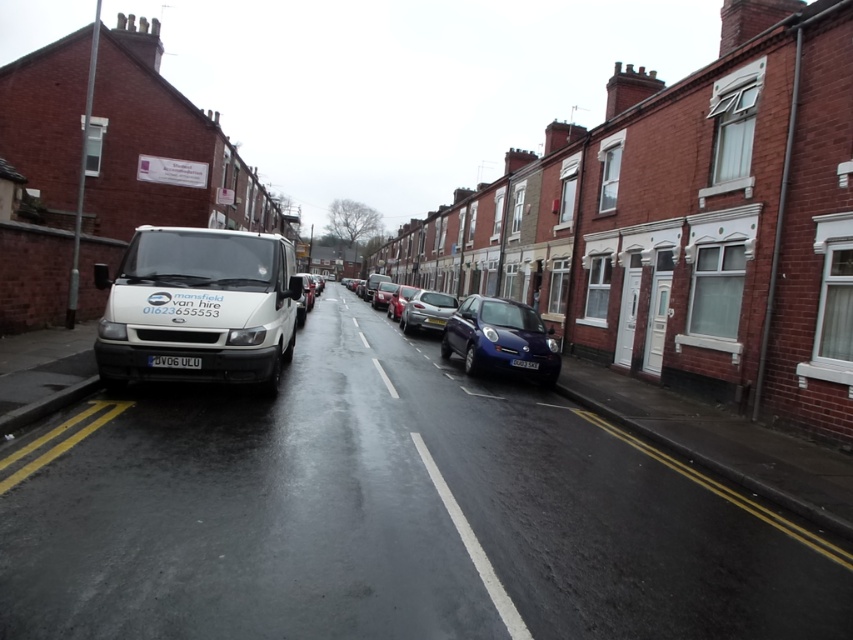
Question: Which point is closer to the camera taking this photo?

Choices:
 (A) (374, 304)
 (B) (705, 476)
 (C) (531, 368)
 (D) (428, 460)

Answer: (D)

Question: Observing the image, what is the correct spatial positioning of metallic blue hatchback at center in reference to black plastic license plate at center?

Choices:
 (A) left
 (B) right

Answer: (B)

Question: Can you confirm if white matte van at center is positioned to the right of metallic blue hatchback at center?

Choices:
 (A) no
 (B) yes

Answer: (A)

Question: Which is farther from the yellow plastic license plate at center?

Choices:
 (A) blue matte license plate at center
 (B) white matte van at center

Answer: (B)

Question: Among these objects, which one is farthest from the camera?

Choices:
 (A) metallic silver hatchback at center
 (B) black plastic license plate at center

Answer: (A)

Question: Is metallic blue hatchback at center bigger than black asphalt road at center?

Choices:
 (A) yes
 (B) no

Answer: (A)